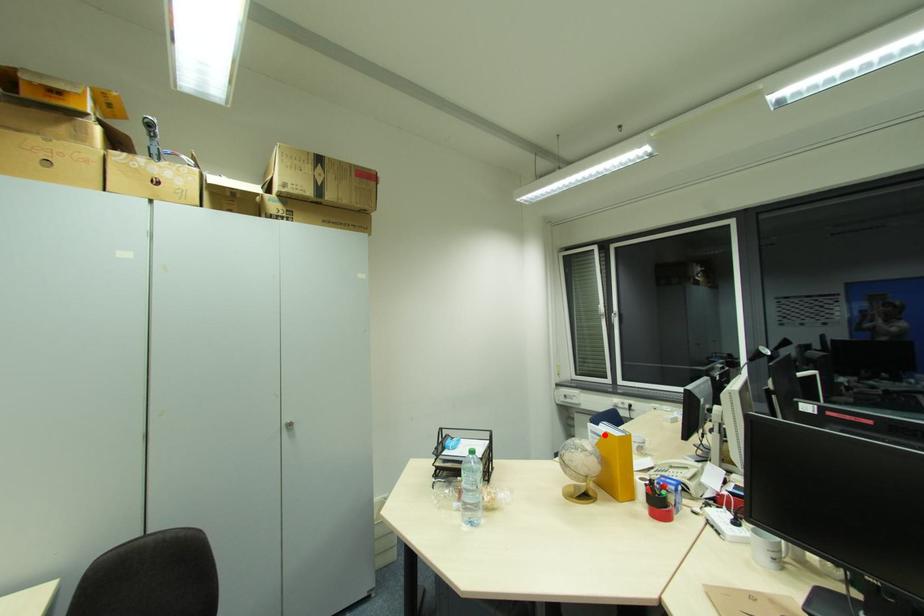
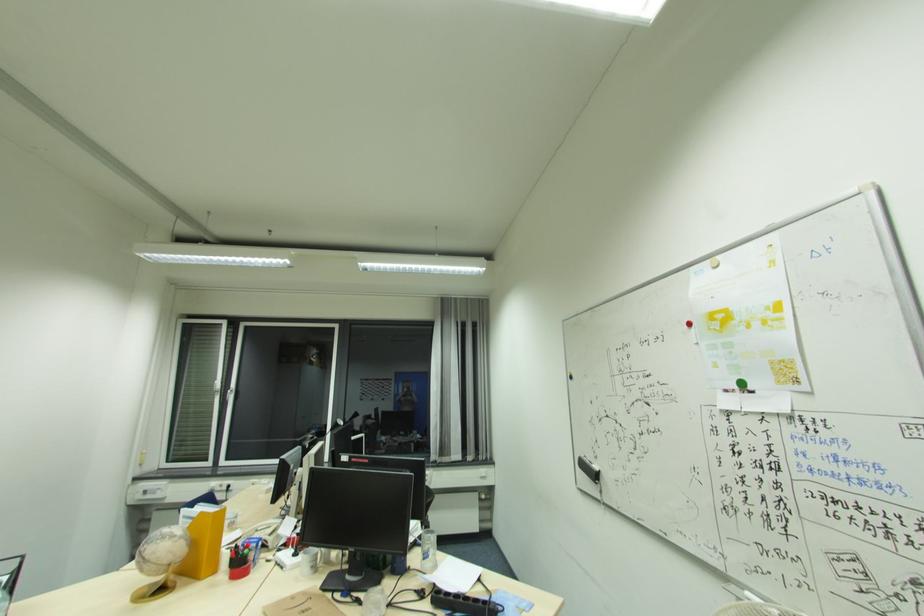
Question: I am providing you with two images of the same scene from different viewpoints. Image1 has a red point marked. In image2, the corresponding 3D location appears at what relative position? Reply with the corresponding letter.

Choices:
 (A) Closer
 (B) Farther

Answer: (B)